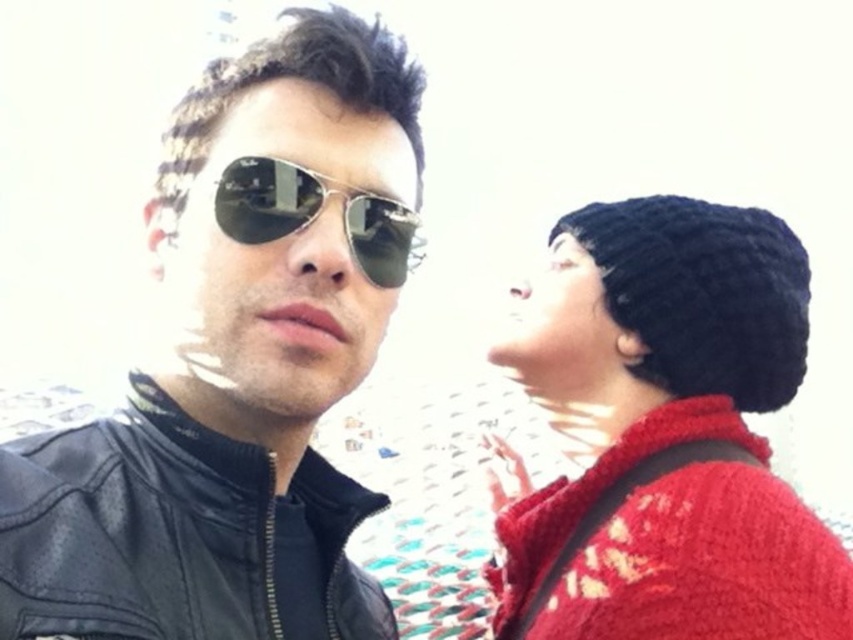
Between knitted black beanie at upper right and metallic aviator sunglasses at center, which one has more height?

Standing taller between the two is knitted black beanie at upper right.

Is point (683, 563) closer to camera compared to point (242, 230)?

That is False.

I want to click on knitted black beanie at upper right, so click(664, 429).

Between point (172, 115) and point (242, 192), which one is positioned in front?

Point (242, 192) is more forward.

Who is more distant from viewer, (256, 589) or (236, 157)?

Positioned behind is point (236, 157).

Where is `leather jacket at center`? leather jacket at center is located at coordinates (236, 364).

Who is more distant from viewer, (x=184, y=140) or (x=685, y=333)?

Positioned behind is point (x=685, y=333).

Consider the image. Measure the distance from leather jacket at center to knitted black beanie at upper right.

The distance of leather jacket at center from knitted black beanie at upper right is 4.68 feet.

This screenshot has height=640, width=853. Describe the element at coordinates (236, 364) in the screenshot. I see `leather jacket at center` at that location.

This screenshot has width=853, height=640. I want to click on leather jacket at center, so click(x=236, y=364).